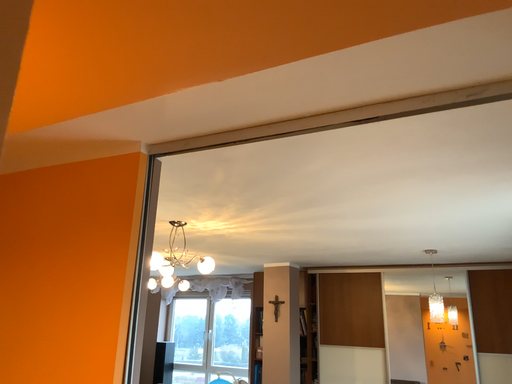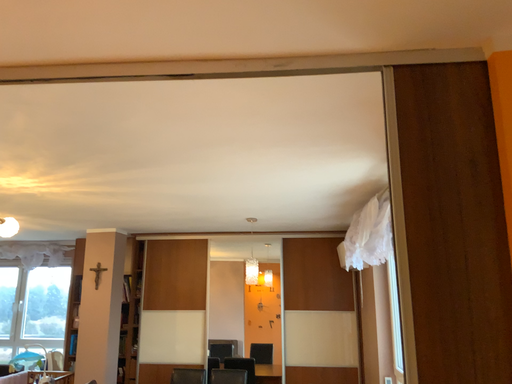
Question: Which way did the camera rotate in the video?

Choices:
 (A) rotated right
 (B) rotated left

Answer: (A)